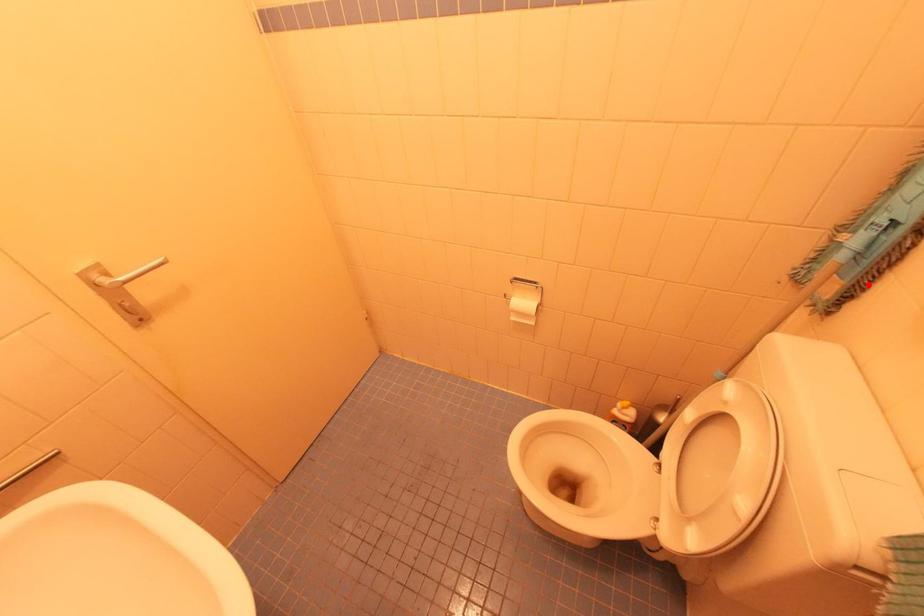
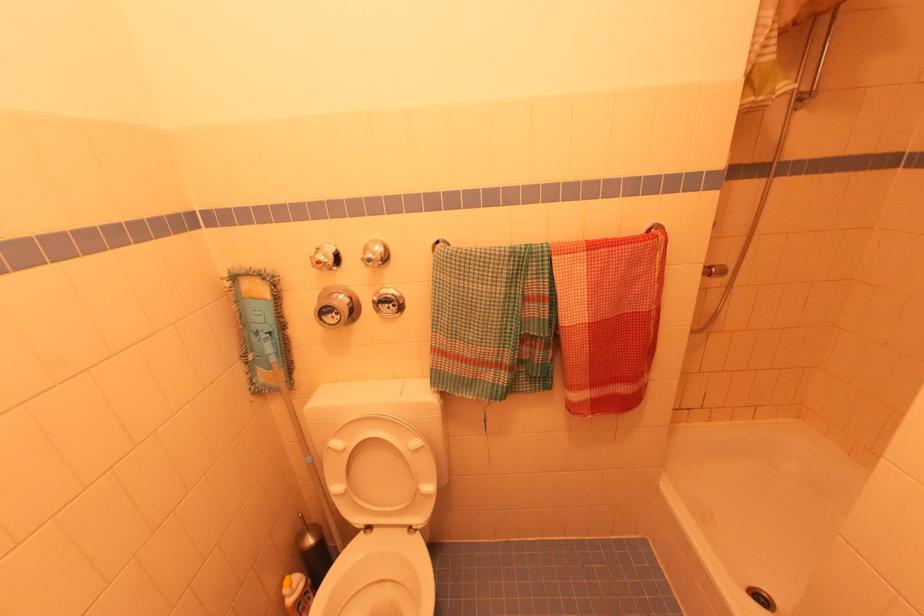
Question: I am providing you with two images of the same scene from different viewpoints. A red point is shown in image1. For the corresponding object point in image2, is it positioned nearer or farther from the camera?

Choices:
 (A) Nearer
 (B) Farther

Answer: (A)